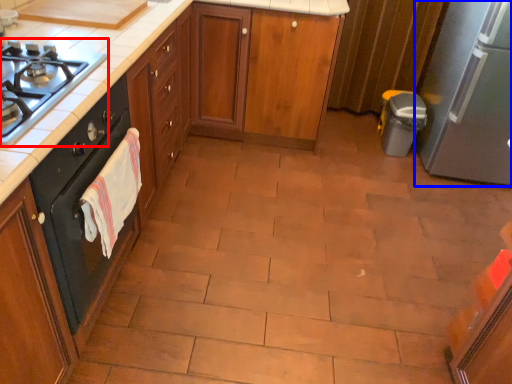
Question: Among these objects, which one is nearest to the camera, gas stove (highlighted by a red box) or kitchen appliance (highlighted by a blue box)?

Choices:
 (A) gas stove
 (B) kitchen appliance

Answer: (A)